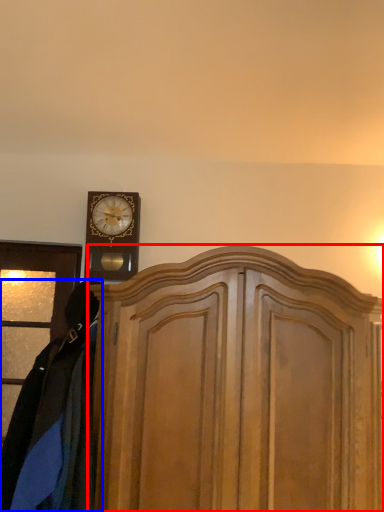
Question: Which point is further to the camera, dresser (highlighted by a red box) or clothing (highlighted by a blue box)?

Choices:
 (A) dresser
 (B) clothing

Answer: (A)